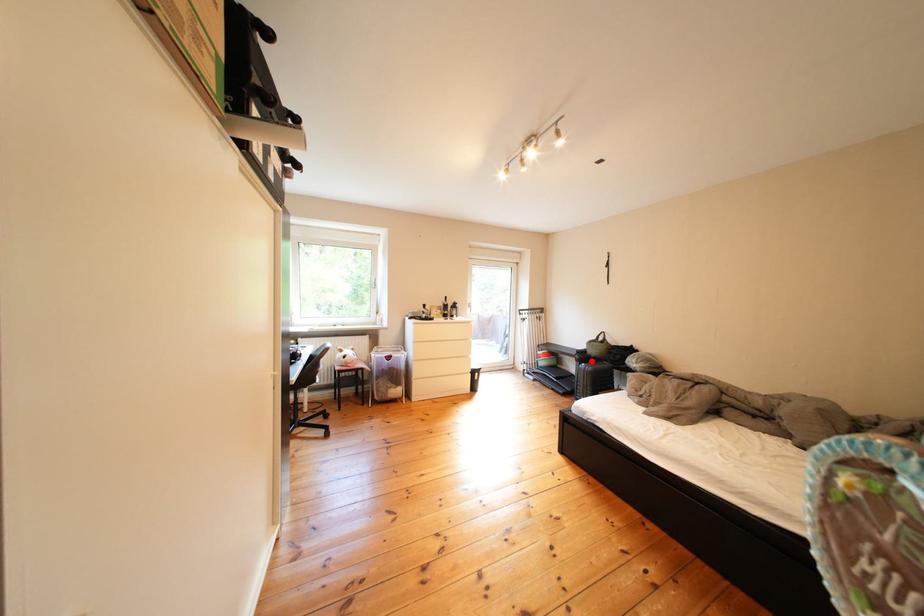
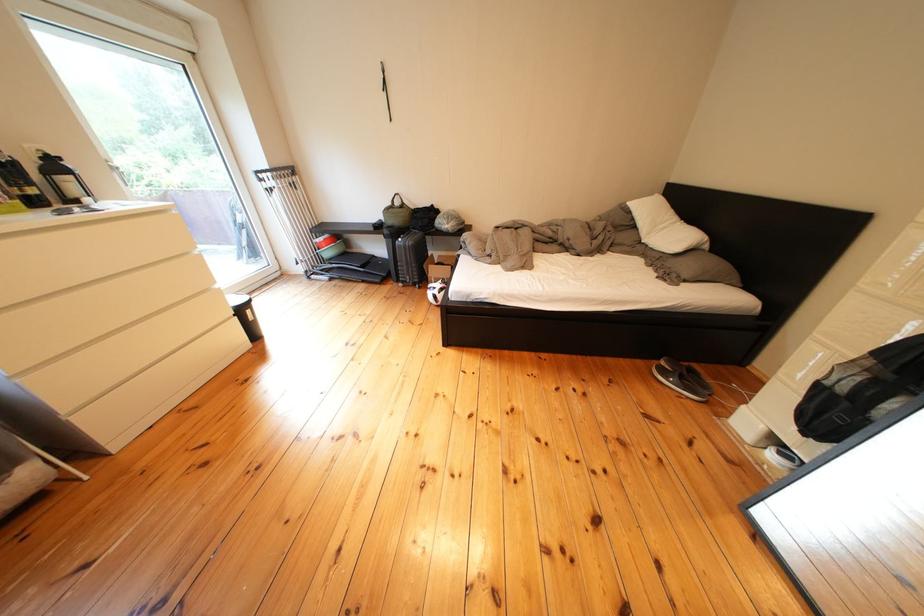
In the second image, find the point that corresponds to the highlighted location in the first image.

(399, 236)